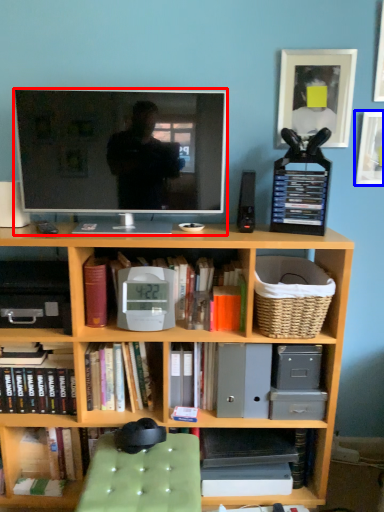
Question: Which object appears farthest to the camera in this image, television (highlighted by a red box) or picture frame (highlighted by a blue box)?

Choices:
 (A) television
 (B) picture frame

Answer: (B)